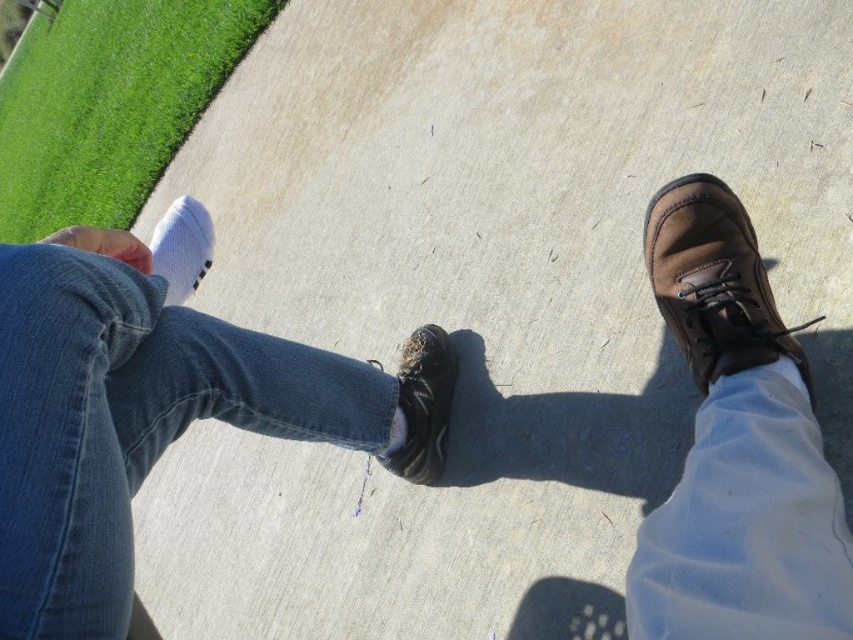
Question: Considering the relative positions of denim at left and white soft sock at lower left in the image provided, where is denim at left located with respect to white soft sock at lower left?

Choices:
 (A) above
 (B) below

Answer: (B)

Question: Based on their relative distances, which object is farther from the white soft sock at lower left?

Choices:
 (A) brown suede boot at right
 (B) brown suede shoe at right
 (C) denim at left

Answer: (B)

Question: Is denim at left wider than brown suede shoe at right?

Choices:
 (A) no
 (B) yes

Answer: (B)

Question: Which object is positioned closest to the white soft sock at lower left?

Choices:
 (A) brown suede shoe at right
 (B) shiny black shoe at center
 (C) brown suede boot at right

Answer: (B)

Question: Which object is farther from the camera taking this photo?

Choices:
 (A) brown suede shoe at right
 (B) white soft sock at lower left

Answer: (B)

Question: Does brown suede boot at right lie behind white soft sock at lower left?

Choices:
 (A) no
 (B) yes

Answer: (A)